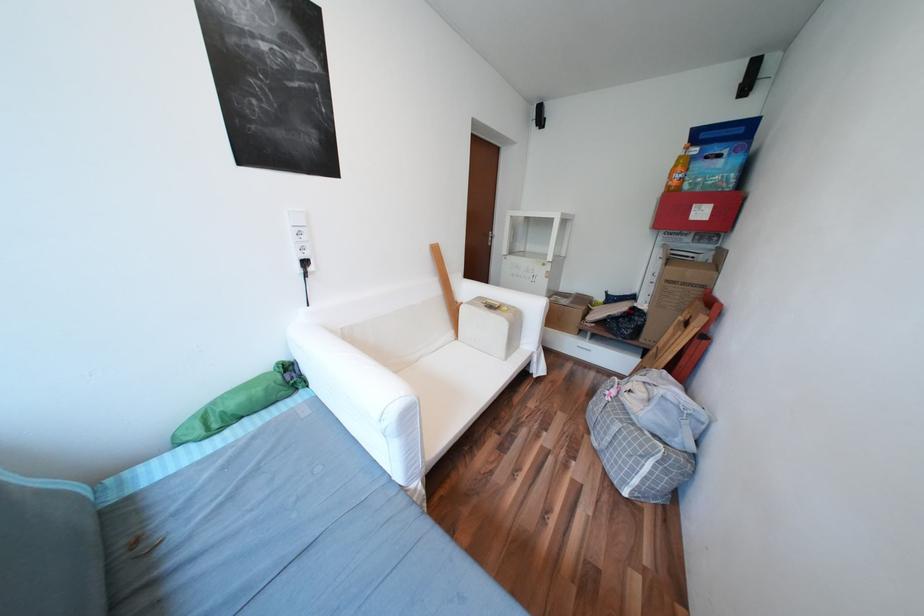
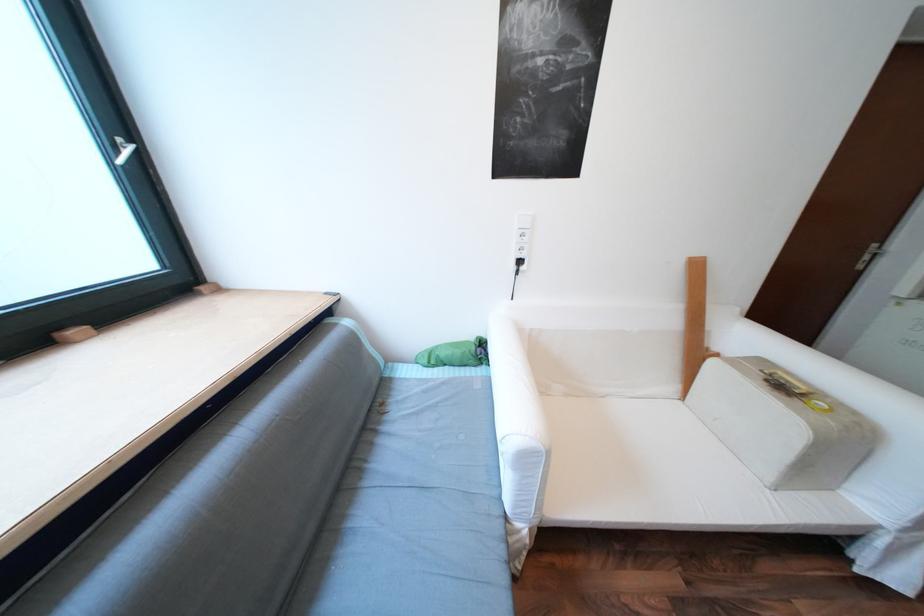
Locate, in the second image, the point that corresponds to pixel 419 472 in the first image.

(528, 511)